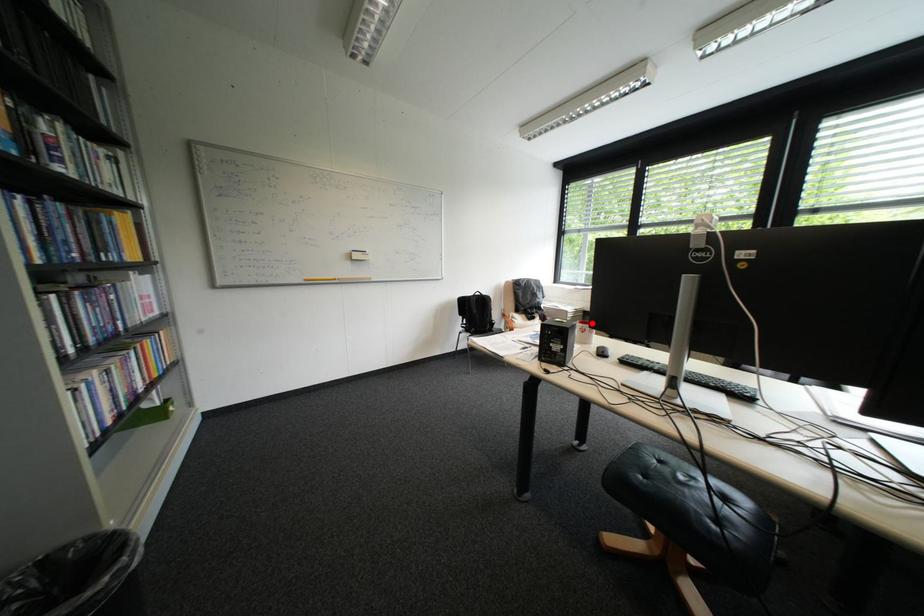
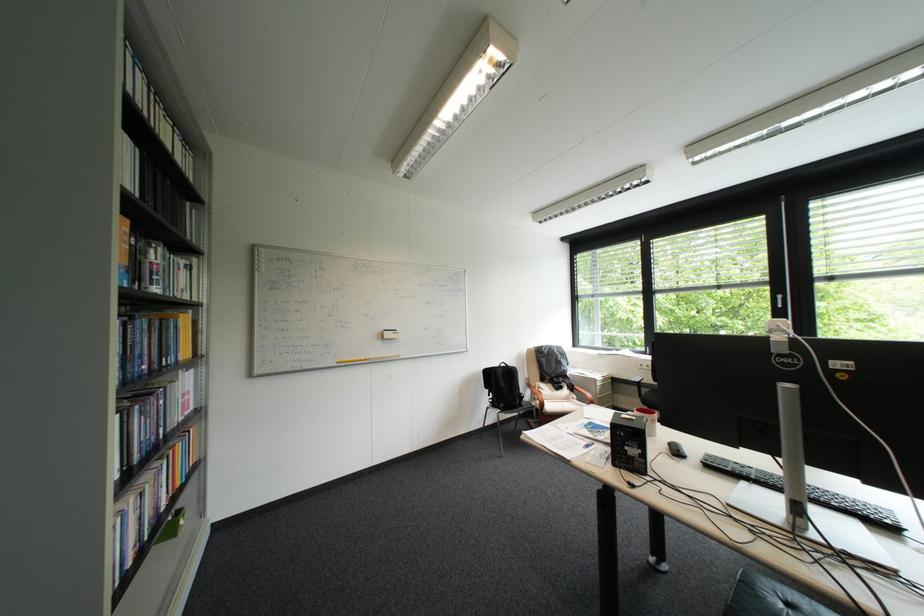
Question: I am providing you with two images of the same scene from different viewpoints. A red point is shown in image1. For the corresponding object point in image2, is it positioned nearer or farther from the camera?

Choices:
 (A) Nearer
 (B) Farther

Answer: (A)